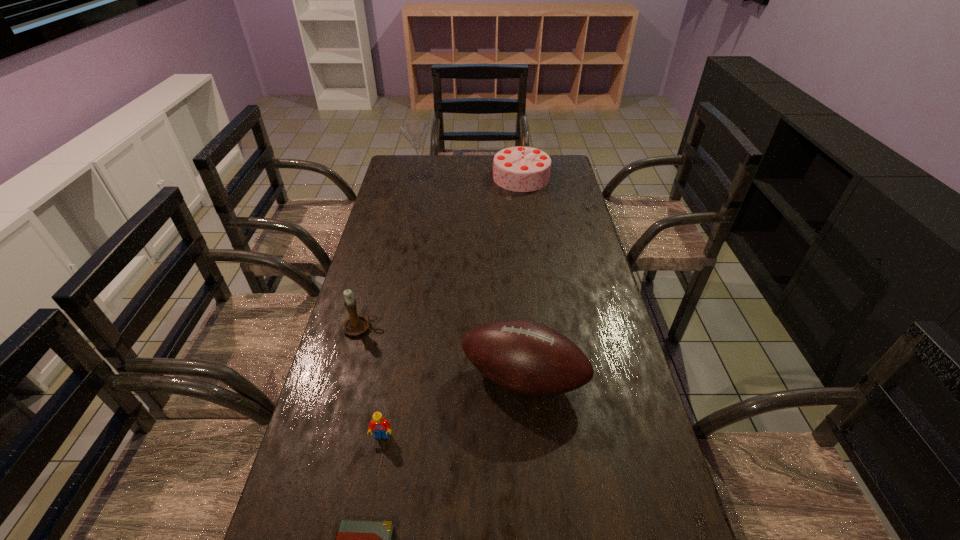
At what (x,y) coordinates should I click in order to perform the action: click on object located in the far right corner section of the desktop. Please return your answer as a coordinate pair (x, y). Looking at the image, I should click on (522, 169).

You are a GUI agent. You are given a task and a screenshot of the screen. Output one action in this format:
    pyautogui.click(x=<x>, y=<y>)
    Task: Click on the free space at the far edge of the desktop
    
    Given the screenshot: What is the action you would take?
    pyautogui.click(x=463, y=176)

You are a GUI agent. You are given a task and a screenshot of the screen. Output one action in this format:
    pyautogui.click(x=<x>, y=<y>)
    Task: Click on the vacant area at the left edge of the desktop
    The height and width of the screenshot is (540, 960).
    Given the screenshot: What is the action you would take?
    pyautogui.click(x=388, y=236)

At what (x,y) coordinates should I click in order to perform the action: click on free location at the right edge of the desktop. Please return your answer as a coordinate pair (x, y). This screenshot has width=960, height=540. Looking at the image, I should click on (550, 246).

I want to click on blank space at the far left corner of the desktop, so click(x=408, y=181).

Image resolution: width=960 pixels, height=540 pixels. Find the location of `vacant area between the flute glass and the third nearest object`. vacant area between the flute glass and the third nearest object is located at coordinates (x=471, y=277).

Identify the location of empty space between the football (American) and the birthday cake. The image size is (960, 540). (522, 278).

This screenshot has width=960, height=540. I want to click on empty space between the birthday cake and the second nearest object, so click(452, 307).

This screenshot has height=540, width=960. In order to click on free spot between the birthday cake and the football (American) in this screenshot , I will do `click(522, 278)`.

Locate an element on the screen. The width and height of the screenshot is (960, 540). free area in between the second nearest object and the tallest object is located at coordinates (401, 306).